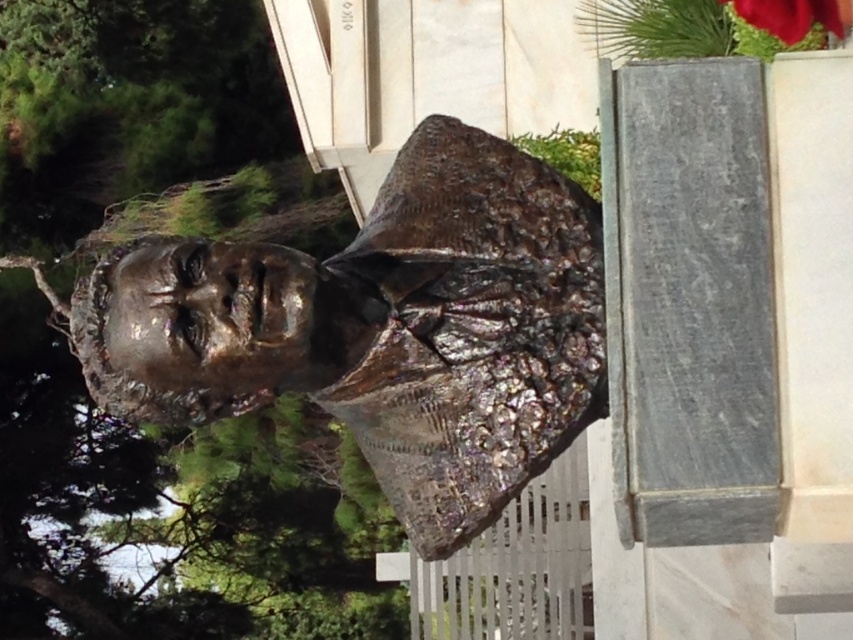
Question: Does shiny bronze bust at center have a larger size compared to smooth red flower at upper right?

Choices:
 (A) no
 (B) yes

Answer: (B)

Question: Is shiny bronze bust at center to the right of smooth red flower at upper right from the viewer's perspective?

Choices:
 (A) yes
 (B) no

Answer: (B)

Question: Which point is closer to the camera taking this photo?

Choices:
 (A) (770, 16)
 (B) (500, 298)

Answer: (B)

Question: Does shiny bronze bust at center have a larger size compared to smooth red flower at upper right?

Choices:
 (A) no
 (B) yes

Answer: (B)